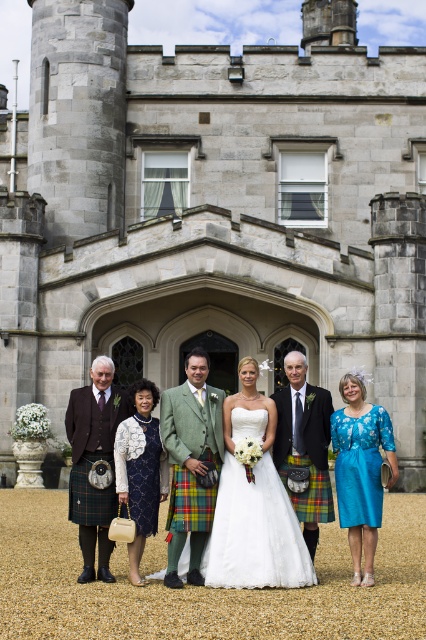
Does point (287, 541) lie in front of point (241, 380)?

Yes, it is.

Which is behind, point (299, 448) or point (253, 540)?

Point (299, 448)

At what (x,y) coordinates should I click in order to perform the action: click on matte green kilt at center. Please return your answer as a coordinate pair (x, y). The width and height of the screenshot is (426, 640). Looking at the image, I should click on (253, 497).

Is matte green kilt at center above dark brown wool kilt at left?

Yes, matte green kilt at center is above dark brown wool kilt at left.

Does matte green kilt at center come in front of dark brown wool kilt at left?

Yes, matte green kilt at center is in front of dark brown wool kilt at left.

Is point (298, 554) positioned before point (106, 502)?

Yes.

Identify the location of matte green kilt at center. (253, 497).

Does dark brown wool kilt at left have a smaller size compared to plaid wool kilt at center?

Incorrect, dark brown wool kilt at left is not smaller in size than plaid wool kilt at center.

Can you confirm if dark brown wool kilt at left is positioned to the left of plaid wool kilt at center?

Correct, you'll find dark brown wool kilt at left to the left of plaid wool kilt at center.

At what (x,y) coordinates should I click in order to perform the action: click on dark brown wool kilt at left. Please return your answer as a coordinate pair (x, y). The width and height of the screenshot is (426, 640). Looking at the image, I should click on (94, 460).